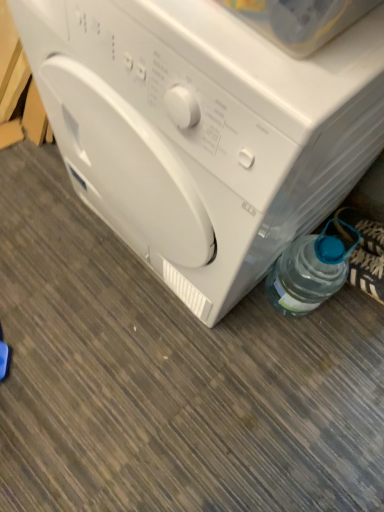
Question: Is white plastic washing machine at center inside the boundaries of clear plastic bottle at lower right, or outside?

Choices:
 (A) outside
 (B) inside

Answer: (A)

Question: Is white plastic washing machine at center in front of or behind clear plastic bottle at lower right in the image?

Choices:
 (A) behind
 (B) front

Answer: (B)

Question: Which of these objects is positioned closest to the white plastic washing machine at center?

Choices:
 (A) white glossy washing machine at center
 (B) clear plastic bottle at lower right

Answer: (B)

Question: Which object is positioned farthest from the clear plastic bottle at lower right?

Choices:
 (A) white plastic washing machine at center
 (B) white glossy washing machine at center

Answer: (A)